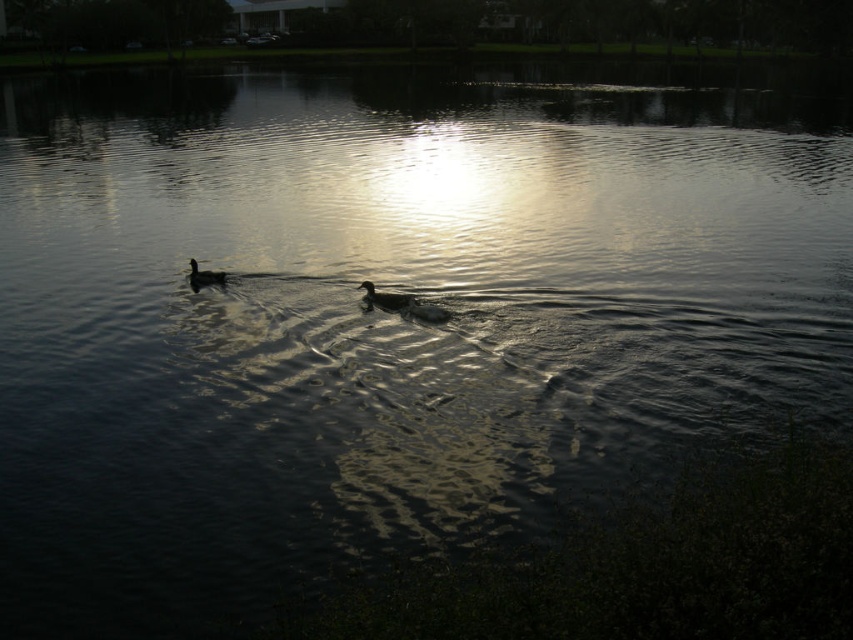
Looking at this image, can you confirm if dark brown feathers at center is positioned to the right of dark brown feathers at left?

Indeed, dark brown feathers at center is positioned on the right side of dark brown feathers at left.

Which is in front, point (409, 304) or point (194, 276)?

Point (409, 304)

Locate an element on the screen. The image size is (853, 640). dark brown feathers at center is located at coordinates (386, 298).